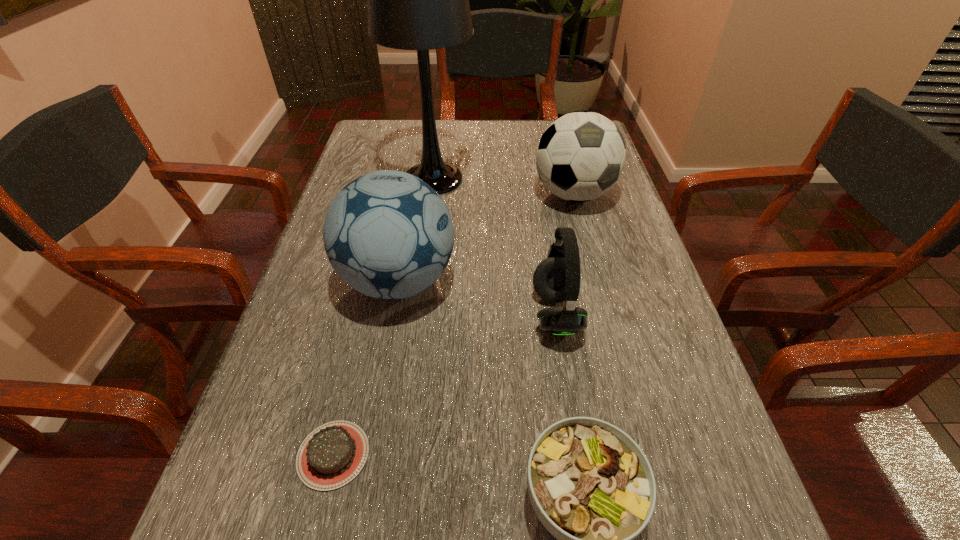
Where is `table lamp`? table lamp is located at coordinates (418, 0).

The width and height of the screenshot is (960, 540). I want to click on the nearer soccer ball, so click(x=389, y=235).

The width and height of the screenshot is (960, 540). Find the location of `the farther soccer ball`. the farther soccer ball is located at coordinates (580, 156).

The height and width of the screenshot is (540, 960). Identify the location of headset. tap(556, 279).

Identify the location of chocolate cake. click(332, 455).

Identify the location of vacant space located on the left of the table lamp. This screenshot has width=960, height=540. (359, 179).

Find the location of `vacant region located on the side with brand of the left soccer ball`. vacant region located on the side with brand of the left soccer ball is located at coordinates (593, 281).

In order to click on free point located on the main logo of the farther soccer ball in this screenshot , I will do `click(592, 267)`.

Locate an element on the screen. This screenshot has width=960, height=540. vacant position located 0.140m on the ear cups of the headset is located at coordinates click(462, 314).

Where is `vacant space located on the ear cups of the headset`? The image size is (960, 540). vacant space located on the ear cups of the headset is located at coordinates (482, 314).